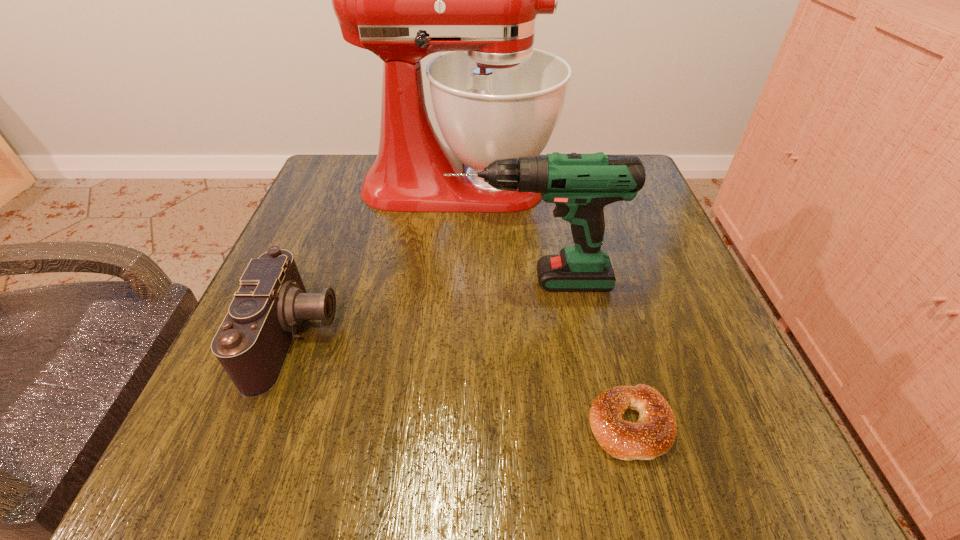
Locate an element on the screen. vacant space that satisfies the following two spatial constraints: 1. on the front-facing side of the camera; 2. on the right side of the shortest object is located at coordinates coord(263,424).

Locate an element on the screen. vacant area in the image that satisfies the following two spatial constraints: 1. on the handle side of the drill; 2. on the right side of the bagel is located at coordinates (548, 424).

Locate an element on the screen. The image size is (960, 540). vacant space that satisfies the following two spatial constraints: 1. at the attachment hub of the shortest object; 2. on the right side of the tallest object is located at coordinates (444, 424).

I want to click on vacant space that satisfies the following two spatial constraints: 1. on the handle side of the second tallest object; 2. on the back side of the shortest object, so click(548, 424).

At what (x,y) coordinates should I click in order to perform the action: click on vacant region that satisfies the following two spatial constraints: 1. on the front-facing side of the bagel; 2. on the left side of the camera. Please return your answer as a coordinate pair (x, y). Image resolution: width=960 pixels, height=540 pixels. Looking at the image, I should click on (263, 424).